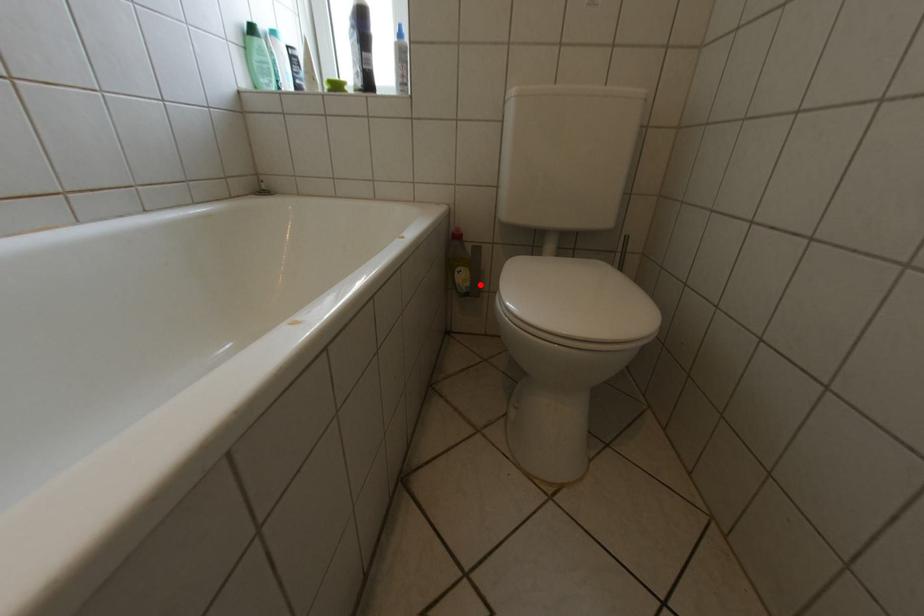
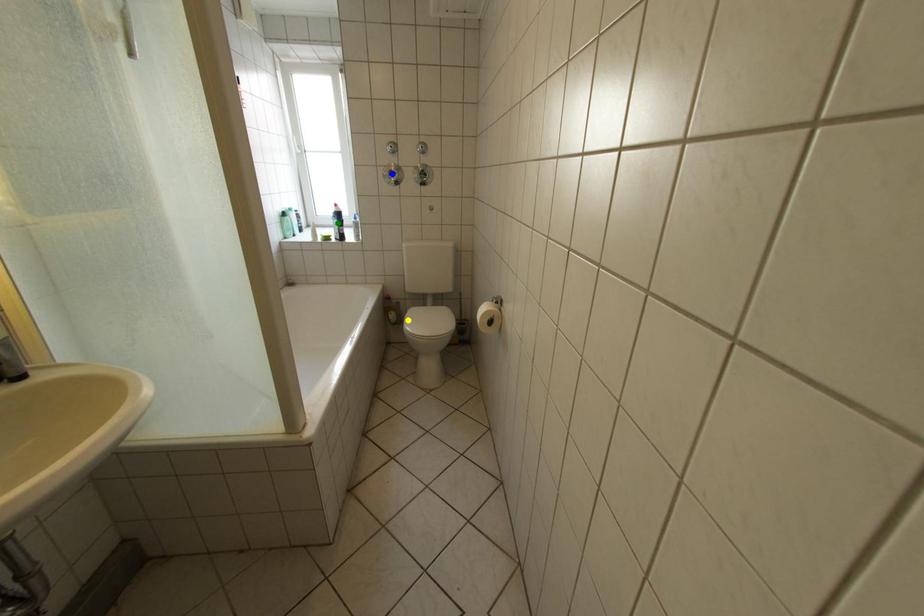
Question: I am providing you with two images of the same scene from different viewpoints. A red point is marked on the first image. You are given multiple points on the second image. Which mark in image 2 goes with the point in image 1?

Choices:
 (A) blue point
 (B) yellow point
 (C) green point

Answer: (B)